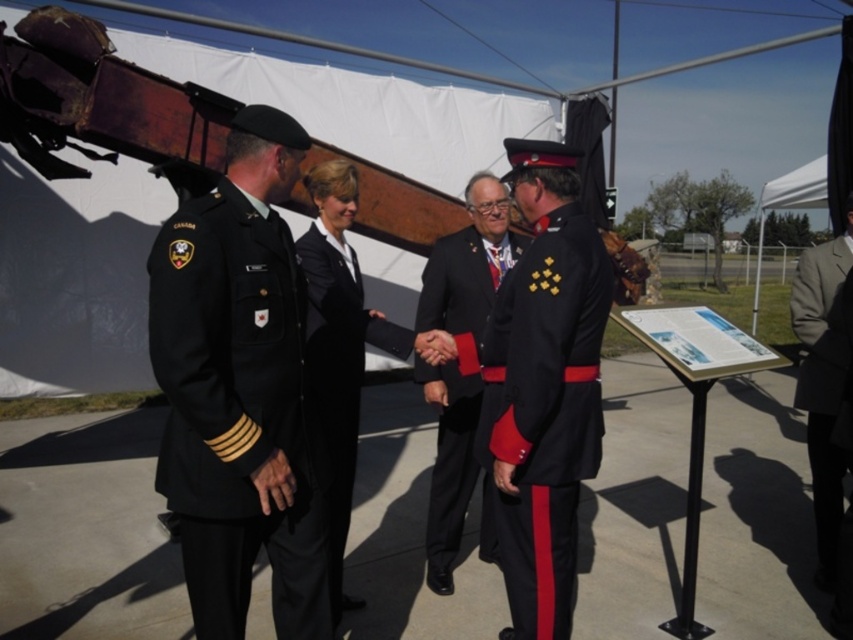
Which is above, black satin uniform at center or light gray suit at right?

light gray suit at right is higher up.

Which is in front, point (554, 515) or point (844, 465)?

Point (554, 515)

This screenshot has height=640, width=853. What are the coordinates of `black satin uniform at center` in the screenshot? It's located at (544, 412).

Between black satin uniform at center and black smooth suit at center, which one is positioned higher?

black satin uniform at center

Does black satin uniform at center appear over black smooth suit at center?

Correct, black satin uniform at center is located above black smooth suit at center.

Measure the distance between point (527, 458) and camera.

The distance of point (527, 458) from camera is 2.41 meters.

Identify the location of black satin uniform at center. This screenshot has height=640, width=853. (544, 412).

Can you confirm if black wool military uniform at left is bigger than shiny black uniform at center?

Incorrect, black wool military uniform at left is not larger than shiny black uniform at center.

Is point (231, 432) behind point (459, 301)?

No, (231, 432) is in front of (459, 301).

Find the location of a particular element. black wool military uniform at left is located at coordinates (236, 413).